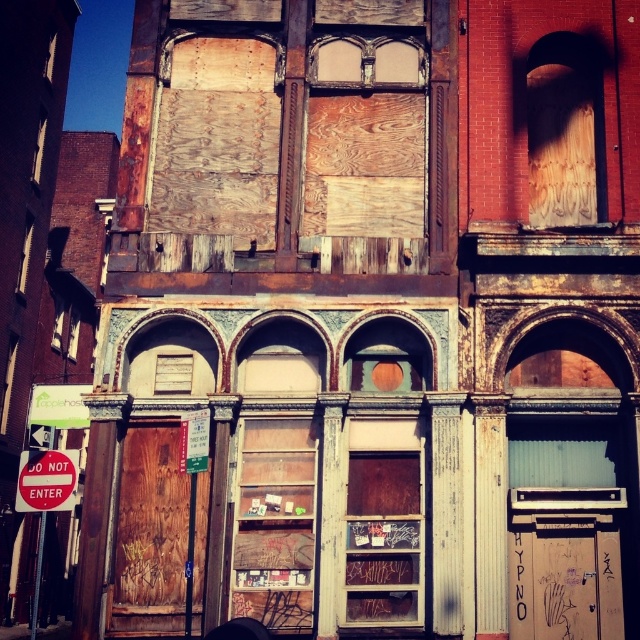
Does red matte sign at lower left have a greater height compared to green plastic sign at center?

Yes, red matte sign at lower left is taller than green plastic sign at center.

Can you confirm if red matte sign at lower left is thinner than green plastic sign at center?

In fact, red matte sign at lower left might be wider than green plastic sign at center.

What do you see at coordinates (45, 481) in the screenshot?
I see `red matte sign at lower left` at bounding box center [45, 481].

Locate an element on the screen. red matte sign at lower left is located at coordinates (45, 481).